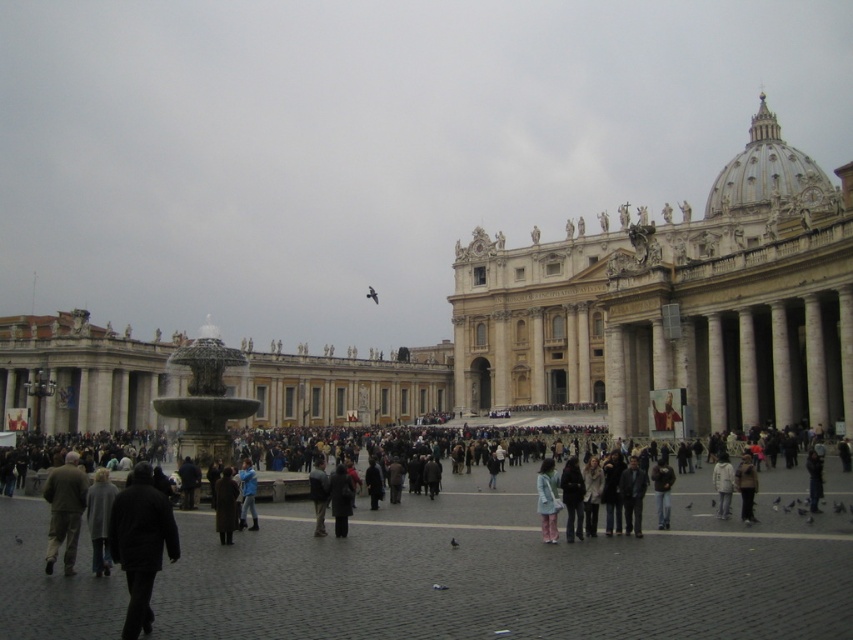
You are a tour guide leading a group through the square. You need to move from the dark gray jacket at center to the dark brown leather jacket at center with a 1.5 meter wide cart. Is there enough space between them for the cart to pass through?

The distance between dark gray jacket at center and dark brown leather jacket at center is 4.13 meters. Since the cart is 1.5 meters wide, there is sufficient space for the cart to pass through as the distance is greater than the cart width.

You are a photographer at St. Peter Square and want to take a portrait of a person wearing dark gray jacket at center and blue denim jeans at center. Since the lighting is soft and diffused, you want to ensure the subject stands out. Which clothing item is narrower so you can frame the shot better?

The dark gray jacket at center is thinner than blue denim jeans at center, so the jacket is narrower. Frame the shot around the dark gray jacket at center to emphasize its narrower silhouette against the background.

You are a photographer in the square and want to position yourself so that both the dark gray jacket at center and the dark brown leather jacket at center are visible in your shot. Which jacket should you place closer to the left edge of the frame to ensure both are included?

You should place the dark gray jacket at center closer to the left edge of the frame since it is already to the left of the dark brown leather jacket at center.